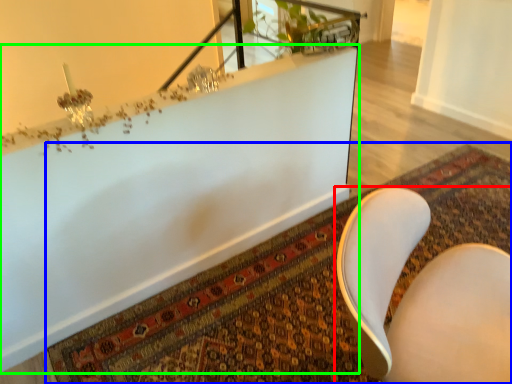
Question: Estimate the real-world distances between objects in this image. Which object is farther from chair (highlighted by a red box), mat (highlighted by a blue box) or bathtub (highlighted by a green box)?

Choices:
 (A) mat
 (B) bathtub

Answer: (B)